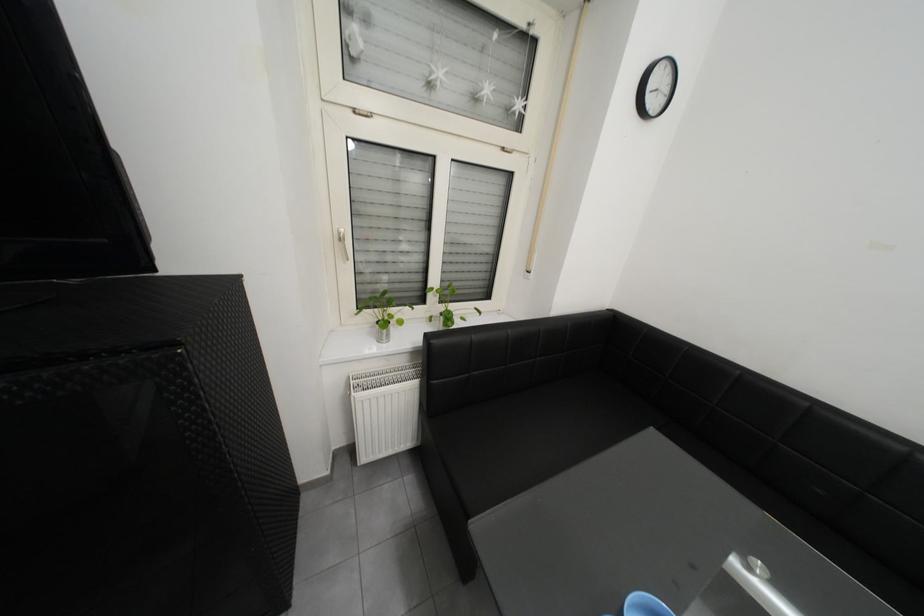
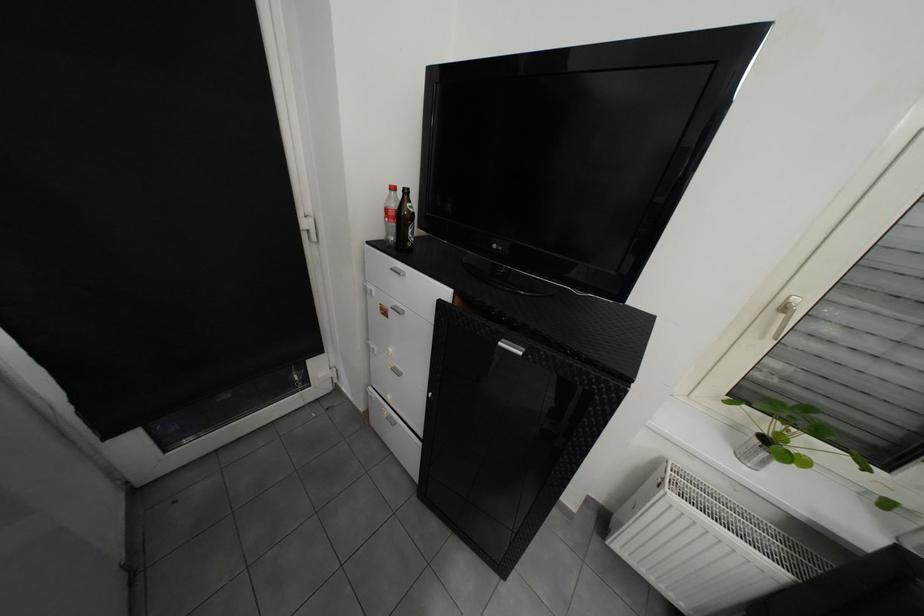
In the second image, find the point that corresponds to the point at 357,264 in the first image.

(773, 339)